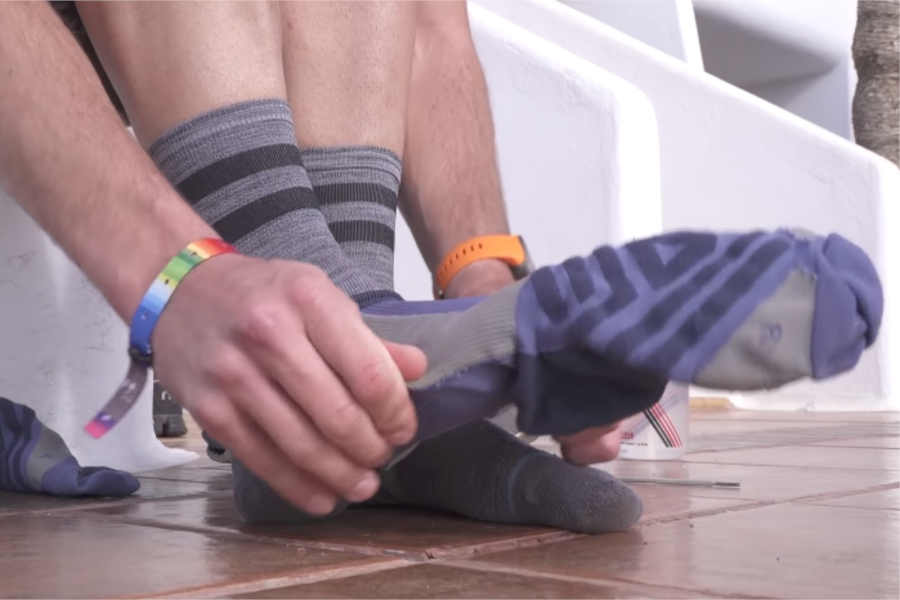
This screenshot has width=900, height=600. What are the coordinates of `reflective surface` in the screenshot? It's located at (157, 552).